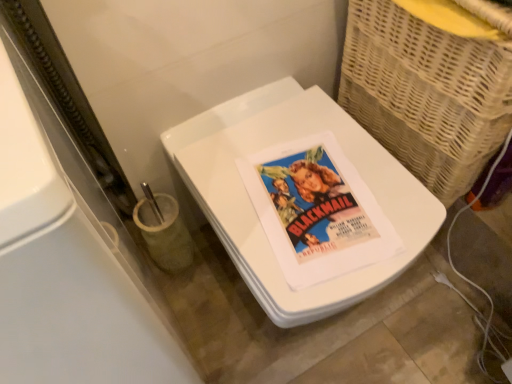
Question: Based on their sizes in the image, would you say woven wicker basket at right is bigger or smaller than white glossy toilet at center?

Choices:
 (A) small
 (B) big

Answer: (A)

Question: Is woven wicker basket at right inside or outside of white glossy toilet at center?

Choices:
 (A) outside
 (B) inside

Answer: (A)

Question: Which of these objects is positioned farthest from the white glossy toilet at center?

Choices:
 (A) matte paper poster at center
 (B) woven wicker basket at right

Answer: (B)

Question: Estimate the real-world distances between objects in this image. Which object is farther from the woven wicker basket at right?

Choices:
 (A) white glossy toilet at center
 (B) matte paper poster at center

Answer: (B)